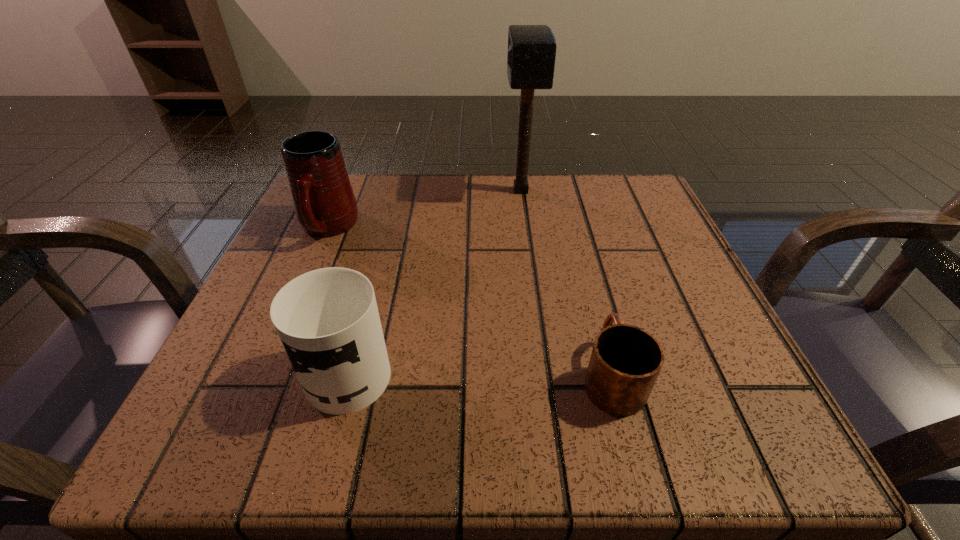
Image resolution: width=960 pixels, height=540 pixels. Identify the location of free space between the second mug from left to right and the tallest object. (436, 278).

The image size is (960, 540). Identify the location of free spot between the rightmost mug and the leftmost mug. click(469, 301).

Where is `unoccupied position between the leftmost mug and the mallet`? This screenshot has width=960, height=540. unoccupied position between the leftmost mug and the mallet is located at coordinates (424, 209).

I want to click on free space between the second mug from right to left and the rightmost object, so coord(482,370).

In order to click on vacant space that's between the shortest object and the mallet in this screenshot , I will do `click(566, 283)`.

Identify the location of object that is the third closest to the second mug from right to left. (531, 55).

Identify the location of the closest object relative to the farthest mug. This screenshot has width=960, height=540. (327, 319).

Where is `mug identified as the closest to the leftmost mug`? The image size is (960, 540). mug identified as the closest to the leftmost mug is located at coordinates (327, 319).

Identify which mug is the second nearest to the rightmost mug. Please provide its 2D coordinates. Your answer should be formatted as a tuple, i.e. [(x, y)], where the tuple contains the x and y coordinates of a point satisfying the conditions above.

[(325, 205)]

You are a GUI agent. You are given a task and a screenshot of the screen. Output one action in this format:
    pyautogui.click(x=<x>, y=<y>)
    Task: Click on the free region that satisfies the following two spatial constraints: 1. on the handle side of the third object from right to left; 2. on the right side of the tallest object
    Image resolution: width=960 pixels, height=540 pixels.
    Given the screenshot: What is the action you would take?
    pyautogui.click(x=397, y=191)